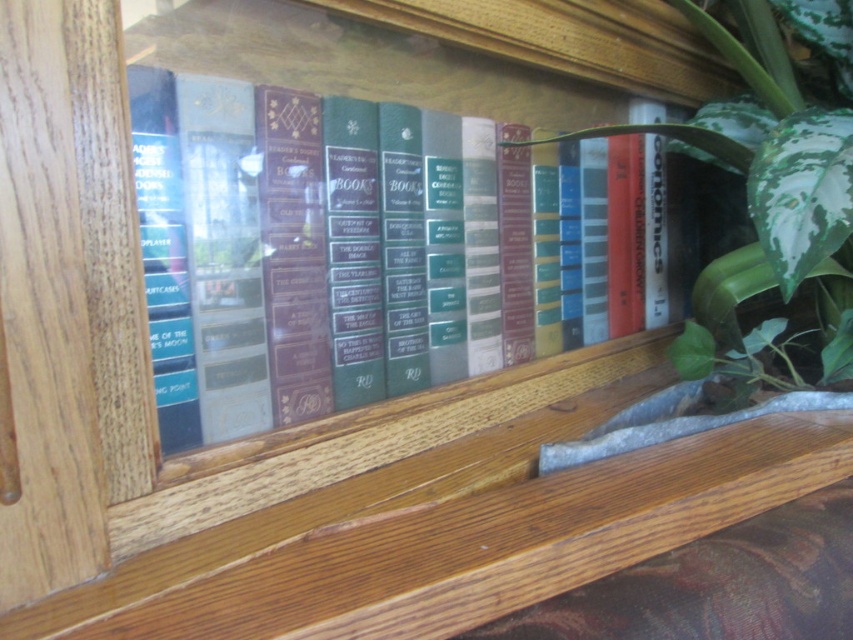
Question: Can you confirm if hardcover books at center is positioned above green leafy plant at right?

Choices:
 (A) no
 (B) yes

Answer: (A)

Question: Can you confirm if hardcover books at center is bigger than green leafy plant at right?

Choices:
 (A) no
 (B) yes

Answer: (A)

Question: Which point is farther to the camera?

Choices:
 (A) pos(270,381)
 (B) pos(833,81)

Answer: (B)

Question: Can you confirm if hardcover books at center is positioned to the left of green leafy plant at right?

Choices:
 (A) yes
 (B) no

Answer: (A)

Question: Among these points, which one is farthest from the camera?

Choices:
 (A) (169, 81)
 (B) (798, 211)

Answer: (B)